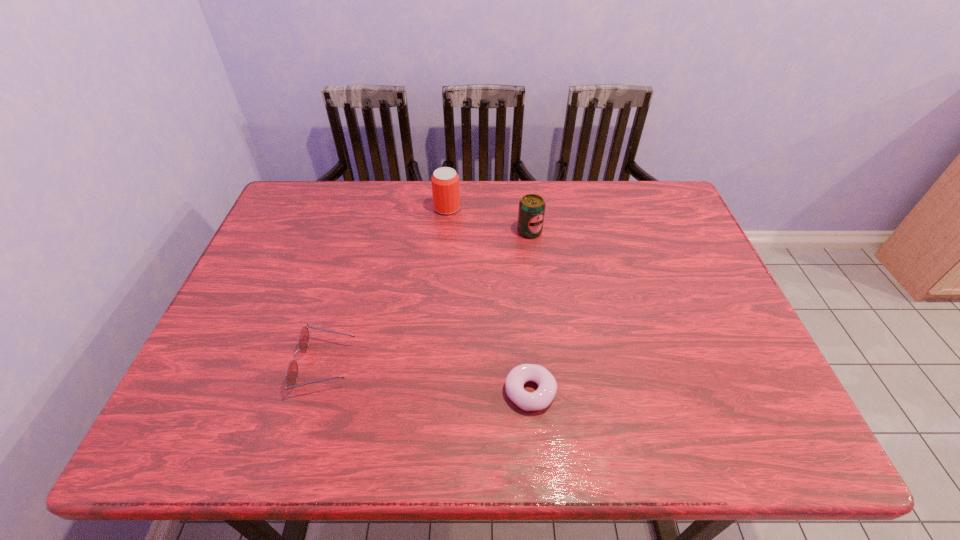
Image resolution: width=960 pixels, height=540 pixels. Find the location of `the third object from right to left`. the third object from right to left is located at coordinates click(445, 181).

What are the coordinates of `the left beer can` in the screenshot? It's located at (445, 181).

In order to click on the third nearest object in this screenshot , I will do `click(531, 212)`.

Locate an element on the screen. The height and width of the screenshot is (540, 960). the right beer can is located at coordinates [531, 212].

The width and height of the screenshot is (960, 540). I want to click on spectacles, so click(303, 340).

Locate an element on the screen. This screenshot has height=540, width=960. the second shortest object is located at coordinates (303, 340).

Where is `doughnut`? doughnut is located at coordinates (541, 398).

This screenshot has height=540, width=960. In order to click on vacant space located on the right of the farthest object in this screenshot , I will do `click(511, 208)`.

I want to click on free space located 0.380m on the left of the second farthest object, so click(x=391, y=231).

Where is `vacant region located 0.200m on the front-facing side of the leftmost object`? This screenshot has width=960, height=540. vacant region located 0.200m on the front-facing side of the leftmost object is located at coordinates (441, 364).